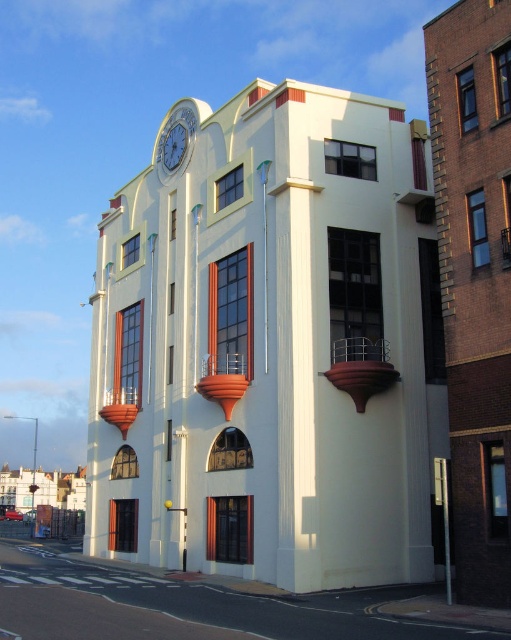
You are standing in front of the modernist building and want to check the time on both the white smooth clock tower at center and the blue glass clock at upper center. Which clock will you need to look up less to see?

The white smooth clock tower at center is closer to the viewer than the blue glass clock at upper center, so you will need to look up less to see the white smooth clock tower at center.

You are standing in front of the modernist building and want to check the time. Where is the white glossy clock at upper center?

The white glossy clock at upper center is located at point (175, 141).